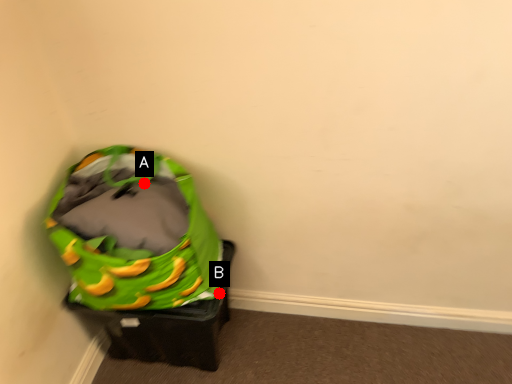
Question: Two points are circled on the image, labeled by A and B beside each circle. Which of the following is the closest to the observer?

Choices:
 (A) A is closer
 (B) B is closer

Answer: (A)